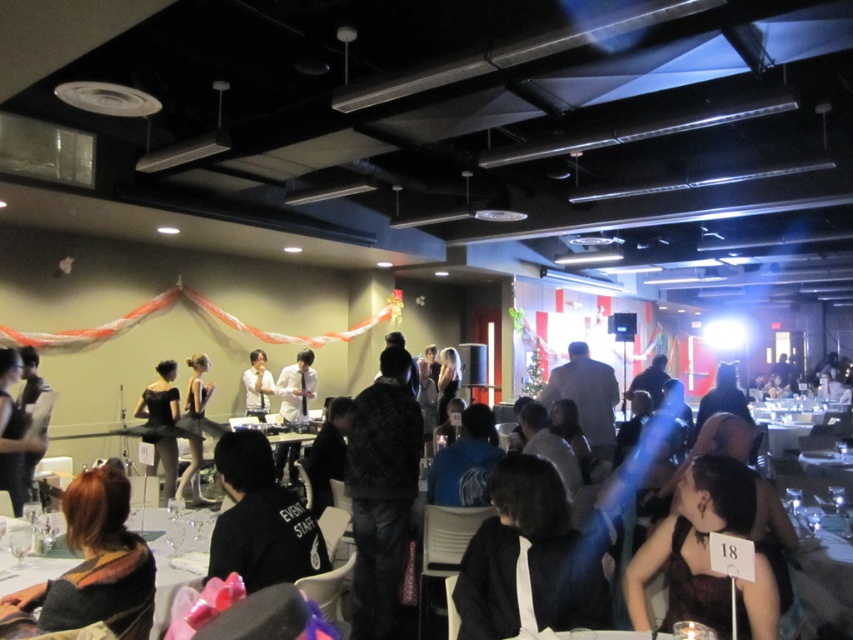
Which is behind, point (795, 556) or point (164, 396)?

The point (164, 396) is behind.

Which is above, metallic silver table at lower right or black satin dress at left?

→ black satin dress at left is above.

Does point (840, 632) come farther from viewer compared to point (170, 400)?

No.

I want to click on metallic silver table at lower right, so click(x=820, y=586).

Is black satin dress at left further to camera compared to white glossy shirt at center?

No, it is in front of white glossy shirt at center.

Who is shorter, black satin dress at left or white glossy shirt at center?

white glossy shirt at center is shorter.

This screenshot has width=853, height=640. What do you see at coordinates (160, 397) in the screenshot? I see `black satin dress at left` at bounding box center [160, 397].

I want to click on black satin dress at left, so coord(160,397).

Measure the distance between point (x=134, y=508) and camera.

Point (x=134, y=508) and camera are 3.88 meters apart.

The width and height of the screenshot is (853, 640). What do you see at coordinates (177, 550) in the screenshot? I see `translucent glass table at lower left` at bounding box center [177, 550].

Who is more forward, (55, 573) or (845, 563)?

Point (55, 573)

The width and height of the screenshot is (853, 640). In order to click on translucent glass table at lower left in this screenshot , I will do `click(177, 550)`.